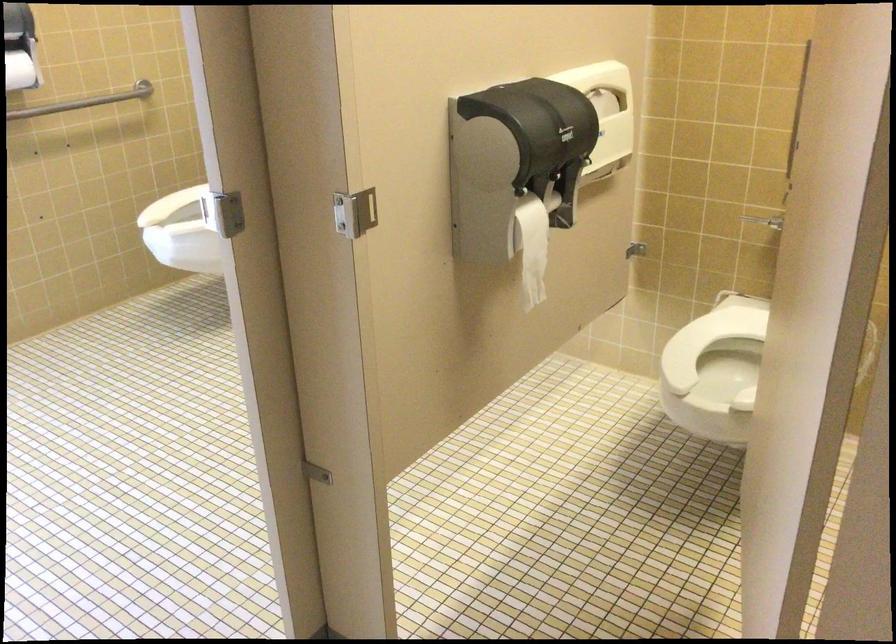
Describe the element at coordinates (774, 223) in the screenshot. The height and width of the screenshot is (644, 896). I see `the toilet flush handle` at that location.